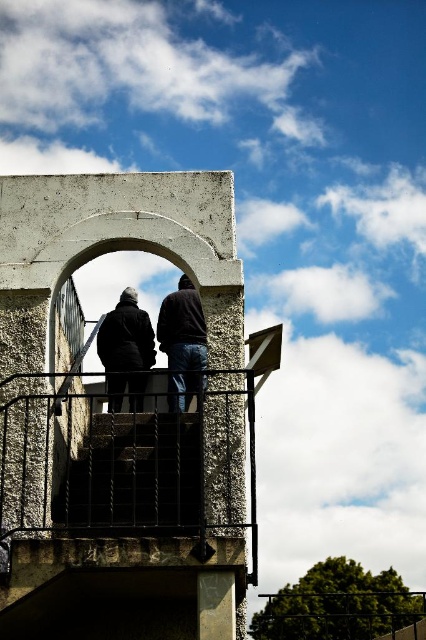
You are standing on the rustic concrete balcony at center and want to move towards the dark blue jeans at center. In which direction should you move?

You should move to the right because the rustic concrete balcony at center is to the left of dark blue jeans at center, so moving right will bring you closer to the dark blue jeans at center.

You are a delivery drone carrying a package that requires a landing zone at least 1.2 meters wide. You are approaching the rustic concrete balcony at center where there is a person wearing a dark matte jacket at center. Can you safely land on the balcony next to the person?

The rustic concrete balcony at center might be wider than dark matte jacket at center, so there is a possibility that the balcony is wide enough for the drone to land safely. However, since the exact width isn not provided, it is recommended to verify the space before landing.

You are a photographer trying to capture a photo of both the dark brown leather jacket at center and the dark matte jacket at center. Since you want to ensure both are fully visible in the frame, which jacket should you focus on first to account for their sizes?

The dark brown leather jacket at center is taller than the dark matte jacket at center, so you should focus on the dark brown leather jacket at center first to ensure it fits within the frame.